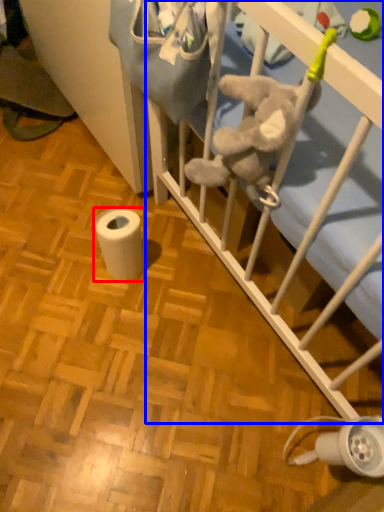
Question: Which object appears closest to the camera in this image, toilet paper (highlighted by a red box) or infant bed (highlighted by a blue box)?

Choices:
 (A) toilet paper
 (B) infant bed

Answer: (B)